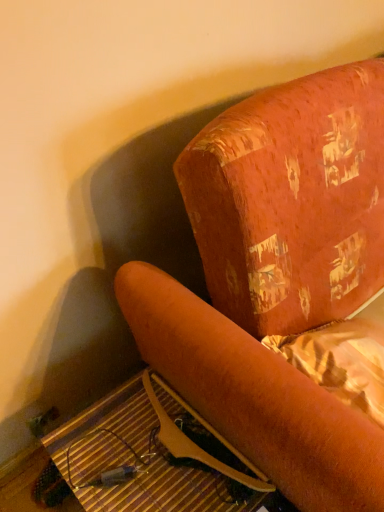
Measure the distance between velvet orange armchair at center and camera.

The distance of velvet orange armchair at center from camera is 24.79 inches.

Describe the element at coordinates (277, 278) in the screenshot. I see `velvet orange armchair at center` at that location.

Where is `velvet orange armchair at center`? The image size is (384, 512). velvet orange armchair at center is located at coordinates (277, 278).

Where is `wooden at lower left`? wooden at lower left is located at coordinates (137, 462).

What do you see at coordinates (137, 462) in the screenshot? I see `wooden at lower left` at bounding box center [137, 462].

Where is `velvet orange armchair at center`? This screenshot has height=512, width=384. velvet orange armchair at center is located at coordinates (277, 278).

Is velvet orange armchair at center to the left or to the right of wooden at lower left in the image?

velvet orange armchair at center is to the right of wooden at lower left.

From the picture: Does velvet orange armchair at center lie in front of wooden at lower left?

Yes, the depth of velvet orange armchair at center is less than that of wooden at lower left.

Is point (343, 493) more distant than point (115, 398)?

No, it is not.

Looking at this image, from the image's perspective, is velvet orange armchair at center located above wooden at lower left?

Correct, velvet orange armchair at center appears higher than wooden at lower left in the image.

From a real-world perspective, does velvet orange armchair at center stand above wooden at lower left?

Indeed, from a real-world perspective, velvet orange armchair at center stands above wooden at lower left.

Is velvet orange armchair at center wider or thinner than wooden at lower left?

Clearly, velvet orange armchair at center has more width compared to wooden at lower left.

Considering the relative sizes of velvet orange armchair at center and wooden at lower left in the image provided, is velvet orange armchair at center taller than wooden at lower left?

Yes.

Based on the photo, is velvet orange armchair at center smaller than wooden at lower left?

Actually, velvet orange armchair at center might be larger than wooden at lower left.

Is wooden at lower left surrounded by velvet orange armchair at center?

No, wooden at lower left is located outside of velvet orange armchair at center.

Are velvet orange armchair at center and wooden at lower left far apart?

No, velvet orange armchair at center is in close proximity to wooden at lower left.

Is velvet orange armchair at center positioned with its back to wooden at lower left?

velvet orange armchair at center is not turned away from wooden at lower left.

How many degrees apart are the facing directions of velvet orange armchair at center and wooden at lower left?

The angular difference between velvet orange armchair at center and wooden at lower left is 1.05 degrees.

I want to click on table below the velvet orange armchair at center (from a real-world perspective), so click(x=137, y=462).

Looking at this image, considering the positions of objects wooden at lower left and velvet orange armchair at center in the image provided, who is more to the right, wooden at lower left or velvet orange armchair at center?

From the viewer's perspective, velvet orange armchair at center appears more on the right side.

Considering the relative positions of wooden at lower left and velvet orange armchair at center in the image provided, is wooden at lower left in front of velvet orange armchair at center?

No, wooden at lower left is behind velvet orange armchair at center.

Which is in front, point (125, 433) or point (309, 267)?

The point (309, 267) is more forward.

From the image's perspective, is wooden at lower left on top of velvet orange armchair at center?

Actually, wooden at lower left appears below velvet orange armchair at center in the image.

From a real-world perspective, is wooden at lower left physically above velvet orange armchair at center?

No, from a real-world perspective, wooden at lower left is not over velvet orange armchair at center

Considering the sizes of objects wooden at lower left and velvet orange armchair at center in the image provided, who is wider, wooden at lower left or velvet orange armchair at center?

velvet orange armchair at center is wider.

Considering the sizes of wooden at lower left and velvet orange armchair at center in the image, is wooden at lower left taller or shorter than velvet orange armchair at center?

Considering their sizes, wooden at lower left has less height than velvet orange armchair at center.

Considering the sizes of wooden at lower left and velvet orange armchair at center in the image, is wooden at lower left bigger or smaller than velvet orange armchair at center?

wooden at lower left is smaller than velvet orange armchair at center.

Is wooden at lower left not inside velvet orange armchair at center?

wooden at lower left lies outside velvet orange armchair at center's area.

Is wooden at lower left in contact with velvet orange armchair at center?

No.

Is wooden at lower left facing away from velvet orange armchair at center?

wooden at lower left does not have its back to velvet orange armchair at center.

How many degrees apart are the facing directions of wooden at lower left and velvet orange armchair at center?

The facing directions of wooden at lower left and velvet orange armchair at center are 1.05 degrees apart.

Measure the distance between wooden at lower left and velvet orange armchair at center.

wooden at lower left and velvet orange armchair at center are 14.44 inches apart from each other.

Locate an element on the screen. The height and width of the screenshot is (512, 384). furniture in front of the wooden at lower left is located at coordinates (277, 278).

Where is `furniture above the wooden at lower left (from the image's perspective)`? This screenshot has width=384, height=512. furniture above the wooden at lower left (from the image's perspective) is located at coordinates (277, 278).

You are a GUI agent. You are given a task and a screenshot of the screen. Output one action in this format:
    pyautogui.click(x=<x>, y=<y>)
    Task: Click on the table on the left of velvet orange armchair at center
    This screenshot has width=384, height=512.
    Given the screenshot: What is the action you would take?
    pyautogui.click(x=137, y=462)